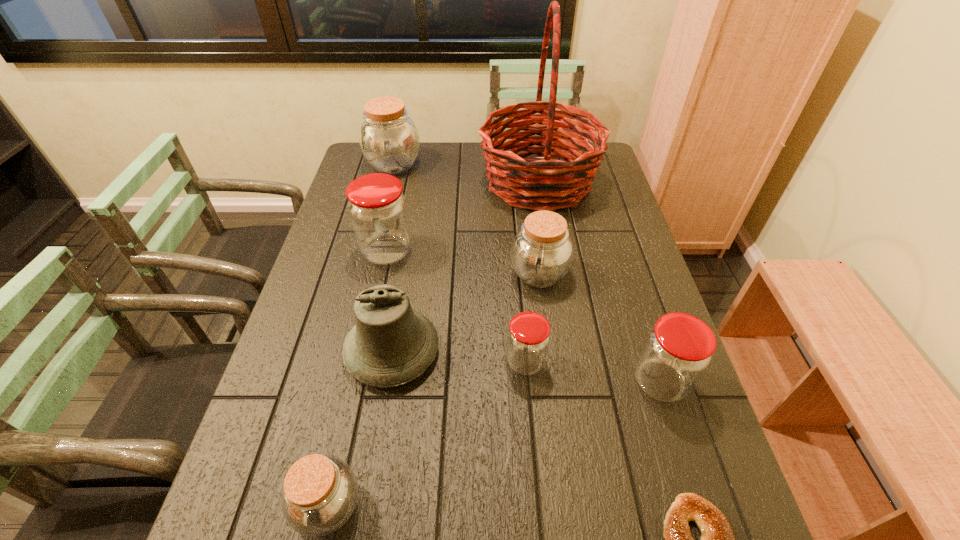
Locate an element on the screen. blank area in the image that satisfies the following two spatial constraints: 1. on the front side of the rightmost jar; 2. on the left side of the basket is located at coordinates (571, 382).

Find the location of a particular element. This screenshot has width=960, height=540. vacant space that satisfies the following two spatial constraints: 1. on the back side of the tallest object; 2. on the left side of the leftmost red jar is located at coordinates (401, 183).